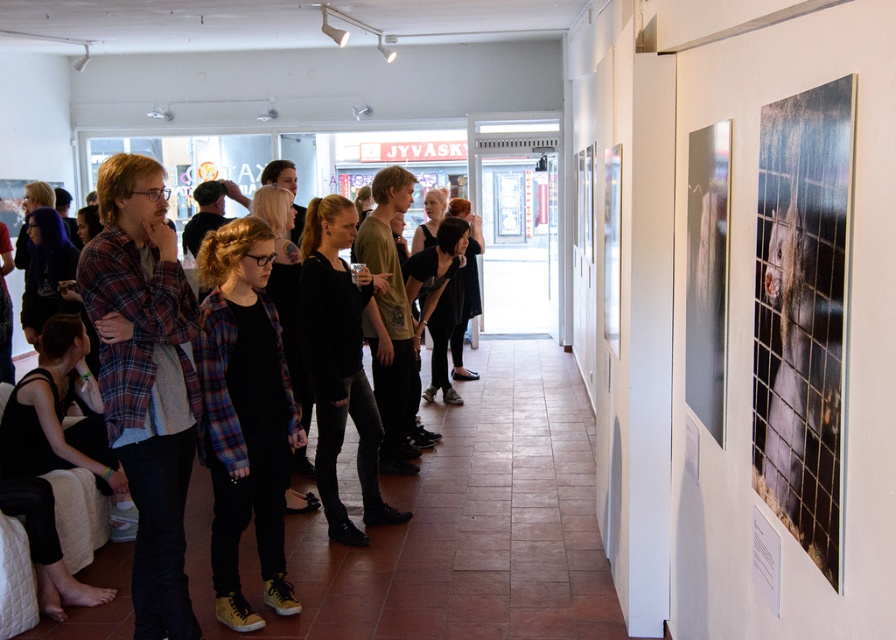
You are an artist in the gallery who wants to hang a new painting between the matte plaid shirt at left and the plaid flannel shirt at center. Based on their current positions, where should you place the new painting?

The matte plaid shirt at left is located above the plaid flannel shirt at center, so the new painting should be placed between them either above or below depending on desired arrangement. However, since the matte plaid shirt at left is already above, placing the new painting below the matte plaid shirt at left and above the plaid flannel shirt at center would maintain vertical order.